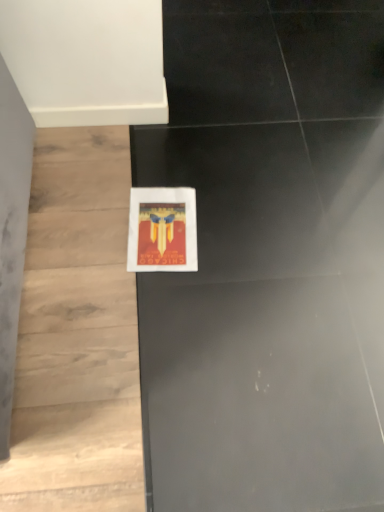
The height and width of the screenshot is (512, 384). What do you see at coordinates (162, 230) in the screenshot?
I see `matte paper picture frame at center` at bounding box center [162, 230].

Where is `matte paper picture frame at center`? matte paper picture frame at center is located at coordinates (162, 230).

What is the approximate width of matte paper picture frame at center?

The width of matte paper picture frame at center is 12.11 inches.

Locate an element on the screen. The image size is (384, 512). matte paper picture frame at center is located at coordinates (162, 230).